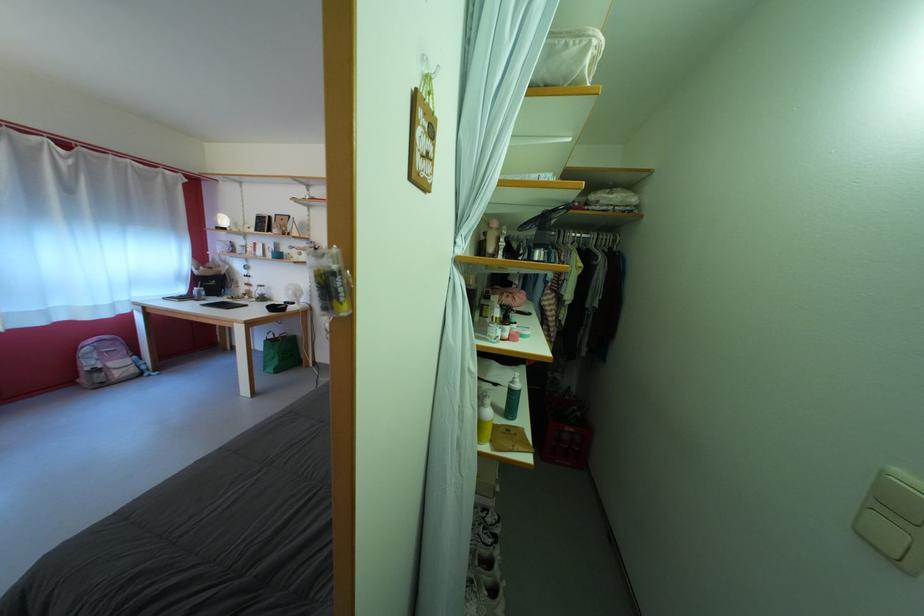
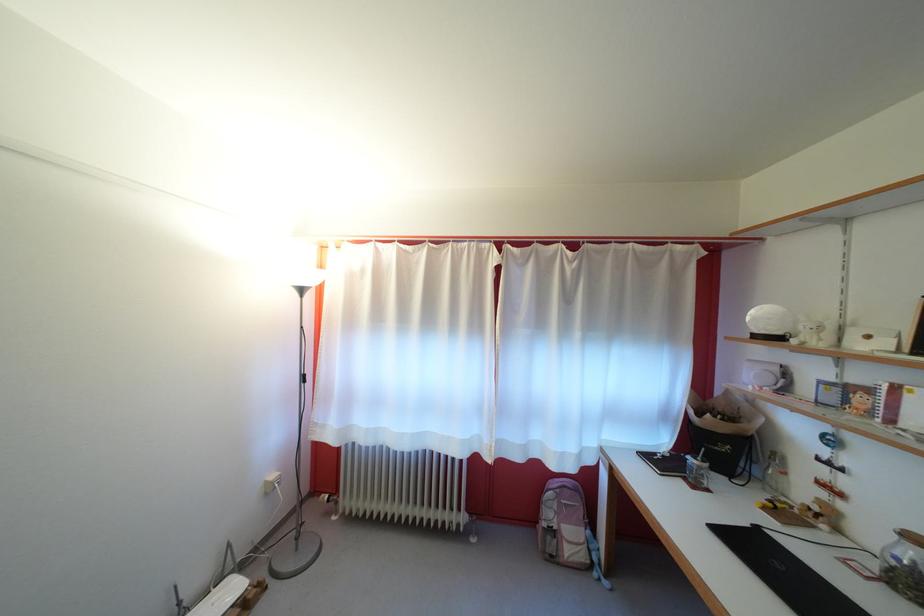
Locate, in the second image, the point that corresponds to the point at 99,370 in the first image.

(556, 521)